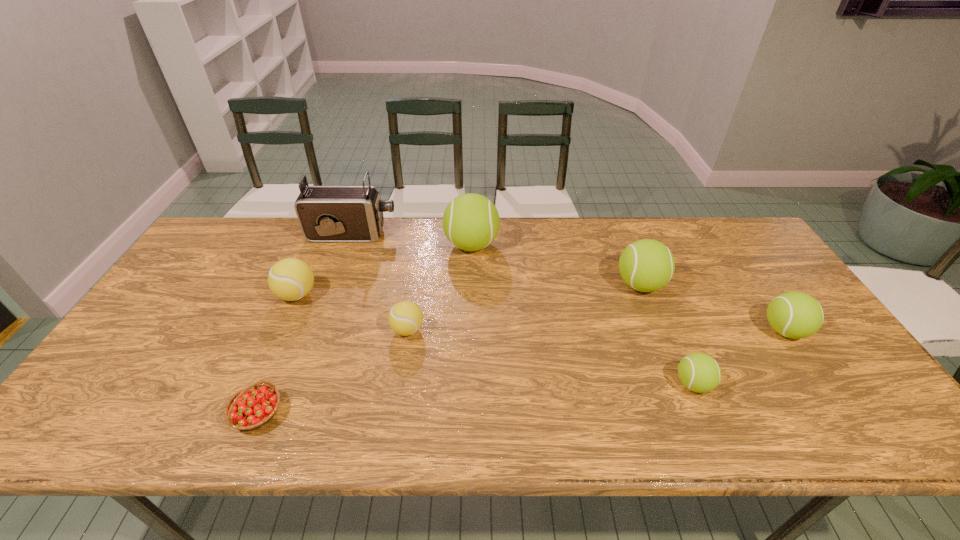
Identify the location of the smallest green tennis ball. This screenshot has height=540, width=960. coord(699,372).

You are a GUI agent. You are given a task and a screenshot of the screen. Output one action in this format:
    pyautogui.click(x=<x>, y=<y>)
    Task: Click on the fourth object from left to right
    This screenshot has height=540, width=960.
    Given the screenshot: What is the action you would take?
    click(x=405, y=318)

I want to click on the right yellow tennis ball, so click(405, 318).

Where is `brown strawberry`? brown strawberry is located at coordinates coord(252,407).

At what (x,y) coordinates should I click in order to perform the action: click on vacant space located 0.300m at the lens of the tallest object. Please return your answer as a coordinate pair (x, y). This screenshot has height=540, width=960. Looking at the image, I should click on (485, 234).

At what (x,y) coordinates should I click in order to perform the action: click on vacant space positioned on the left of the farthest tennis ball. Please return your answer as a coordinate pair (x, y). Looking at the image, I should click on (377, 245).

At what (x,y) coordinates should I click in order to perform the action: click on vacant space located on the back of the third tallest object. Please return your answer as a coordinate pair (x, y). This screenshot has height=540, width=960. Looking at the image, I should click on (613, 218).

Locate an element on the screen. This screenshot has width=960, height=540. vacant region located on the back of the rightmost green tennis ball is located at coordinates (722, 238).

Locate an element on the screen. This screenshot has width=960, height=540. vacant position located on the front of the leftmost tennis ball is located at coordinates (264, 369).

Locate an element on the screen. free point located on the right of the smallest green tennis ball is located at coordinates (804, 384).